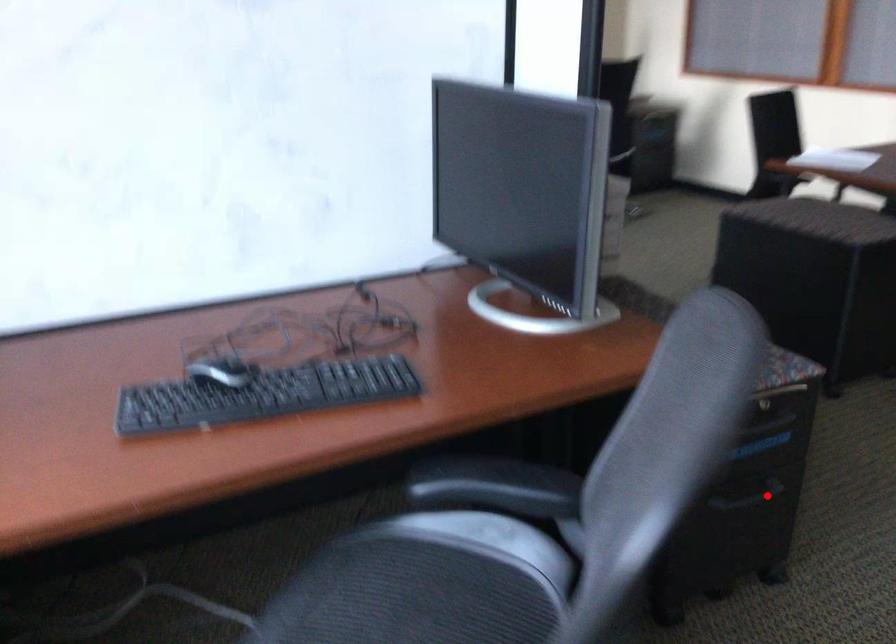
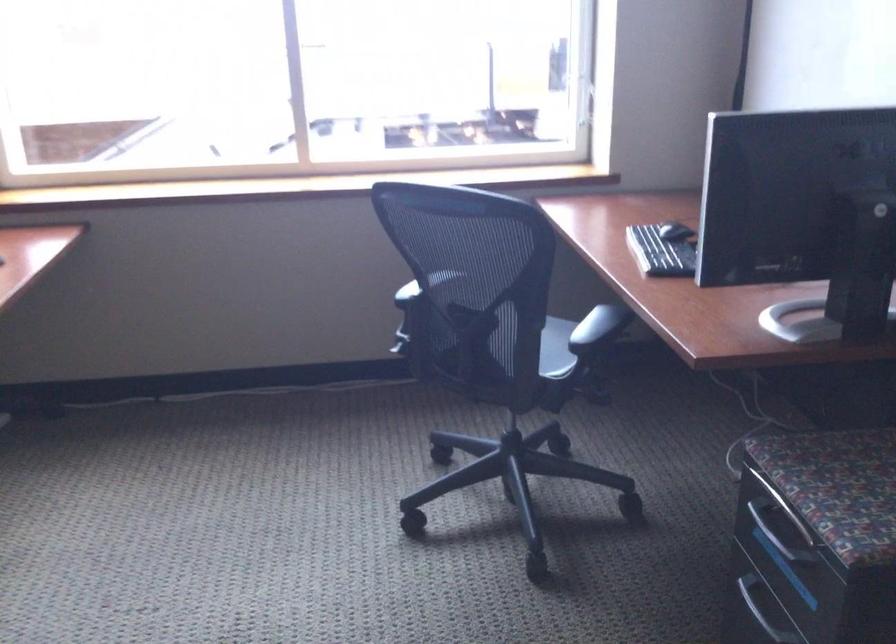
Question: A red point is marked in image1. In image2, is the corresponding 3D point closer to the camera or farther? Reply with the corresponding letter.

Choices:
 (A) The corresponding 3D point is closer.
 (B) The corresponding 3D point is farther.

Answer: (A)